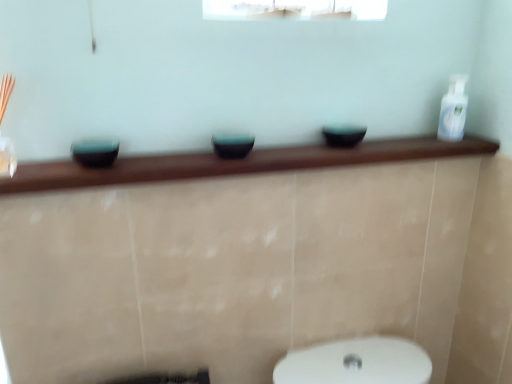
You are a GUI agent. You are given a task and a screenshot of the screen. Output one action in this format:
    pyautogui.click(x=<x>, y=<y>)
    Task: Click on the teal glossy bowl at left, which appears as the 1th basin when viewed from the left
    Image resolution: width=512 pixels, height=384 pixels.
    Given the screenshot: What is the action you would take?
    pyautogui.click(x=95, y=152)

This screenshot has width=512, height=384. What are the coordinates of `white glossy bottle at upper right` in the screenshot? It's located at (453, 109).

Measure the distance between matte black bowl at center, which is the 2th basin from left to right, and camera.

matte black bowl at center, which is the 2th basin from left to right, is 38.02 inches away from camera.

Where is `matte black bowl at center, the 2th basin when ordered from right to left`? The width and height of the screenshot is (512, 384). matte black bowl at center, the 2th basin when ordered from right to left is located at coordinates (232, 145).

Identify the location of matte black bowl at center, which ranks as the 1th basin in right-to-left order. (343, 135).

From the image's perspective, is matte black bowl at center, the 2th basin when ordered from right to left, on top of white glossy bottle at upper right?

No.

Is the depth of matte black bowl at center, the 2th basin when ordered from right to left, greater than that of white glossy bottle at upper right?

No.

Is matte black bowl at center, which is the 2th basin from left to right, in contact with white glossy bottle at upper right?

matte black bowl at center, which is the 2th basin from left to right, and white glossy bottle at upper right are not in contact.

Can you confirm if matte black bowl at center, which is the 2th basin from left to right, is taller than white glossy bottle at upper right?

No, matte black bowl at center, which is the 2th basin from left to right, is not taller than white glossy bottle at upper right.

From the picture: Considering the relative positions of white glossy bottle at upper right and teal glossy bowl at left, which appears as the 1th basin when viewed from the left, in the image provided, is white glossy bottle at upper right to the left or to the right of teal glossy bowl at left, which appears as the 1th basin when viewed from the left,?

Based on their positions, white glossy bottle at upper right is located to the right of teal glossy bowl at left, which appears as the 1th basin when viewed from the left.

From a real-world perspective, relative to teal glossy bowl at left, which appears as the 1th basin when viewed from the left, is white glossy bottle at upper right vertically above or below?

white glossy bottle at upper right is situated higher than teal glossy bowl at left, which appears as the 1th basin when viewed from the left, in the real world.

Can you confirm if white glossy bottle at upper right is wider than teal glossy bowl at left, which appears as the 1th basin when viewed from the left?

In fact, white glossy bottle at upper right might be narrower than teal glossy bowl at left, which appears as the 1th basin when viewed from the left.

From the image's perspective, which object appears higher, white glossy bottle at upper right or teal glossy bowl at left, which is the 3th basin from right to left?

white glossy bottle at upper right.

Is matte black bowl at center, which ranks as the 1th basin in right-to-left order, touching teal glossy bowl at left, which is the 3th basin from right to left?

They are not placed beside each other.

From the image's perspective, who appears lower, matte black bowl at center, which ranks as the 1th basin in right-to-left order, or teal glossy bowl at left, which appears as the 1th basin when viewed from the left?

teal glossy bowl at left, which appears as the 1th basin when viewed from the left, from the image's perspective.

Which of these two, matte black bowl at center, the 3th basin from the left, or teal glossy bowl at left, which appears as the 1th basin when viewed from the left, stands taller?

Standing taller between the two is teal glossy bowl at left, which appears as the 1th basin when viewed from the left.

Does point (345, 147) appear closer or farther from the camera than point (95, 162)?

Point (345, 147) is positioned farther from the camera compared to point (95, 162).

Identify the location of basin on the right side of matte black bowl at center, which is the 2th basin from left to right. (343, 135).

Which object is positioned more to the right, matte black bowl at center, which ranks as the 1th basin in right-to-left order, or matte black bowl at center, which is the 2th basin from left to right?

matte black bowl at center, which ranks as the 1th basin in right-to-left order.

Which object is further away from the camera, matte black bowl at center, which ranks as the 1th basin in right-to-left order, or matte black bowl at center, the 2th basin when ordered from right to left?

matte black bowl at center, which ranks as the 1th basin in right-to-left order, is behind.

Considering the sizes of matte black bowl at center, the 3th basin from the left, and matte black bowl at center, the 2th basin when ordered from right to left, in the image, is matte black bowl at center, the 3th basin from the left, wider or thinner than matte black bowl at center, the 2th basin when ordered from right to left,?

Clearly, matte black bowl at center, the 3th basin from the left, has more width compared to matte black bowl at center, the 2th basin when ordered from right to left.

Considering the sizes of objects matte black bowl at center, the 3th basin from the left, and white glossy bottle at upper right in the image provided, who is thinner, matte black bowl at center, the 3th basin from the left, or white glossy bottle at upper right?

Thinner between the two is white glossy bottle at upper right.

Is matte black bowl at center, which ranks as the 1th basin in right-to-left order, positioned in front of white glossy bottle at upper right?

Yes, matte black bowl at center, which ranks as the 1th basin in right-to-left order, is closer to the camera.

Is matte black bowl at center, which ranks as the 1th basin in right-to-left order, not near white glossy bottle at upper right?

No, matte black bowl at center, which ranks as the 1th basin in right-to-left order, is not far away from white glossy bottle at upper right.

Could you tell me if matte black bowl at center, the 3th basin from the left, is facing white glossy bottle at upper right?

No, matte black bowl at center, the 3th basin from the left, is not facing towards white glossy bottle at upper right.

How different are the orientations of white glossy bottle at upper right and matte black bowl at center, which ranks as the 1th basin in right-to-left order, in degrees?

0.00203 degrees.

Does point (462, 90) come in front of point (326, 131)?

No, (462, 90) is behind (326, 131).

From a real-world perspective, relative to matte black bowl at center, the 3th basin from the left, is white glossy bottle at upper right vertically above or below?

Clearly, from a real-world perspective, white glossy bottle at upper right is above matte black bowl at center, the 3th basin from the left.

Considering the sizes of white glossy bottle at upper right and matte black bowl at center, which ranks as the 1th basin in right-to-left order, in the image, is white glossy bottle at upper right wider or thinner than matte black bowl at center, which ranks as the 1th basin in right-to-left order,?

Clearly, white glossy bottle at upper right has less width compared to matte black bowl at center, which ranks as the 1th basin in right-to-left order.

Consider the image. Can teal glossy bowl at left, which appears as the 1th basin when viewed from the left, be found inside matte black bowl at center, which is the 2th basin from left to right?

No.

Is matte black bowl at center, the 2th basin when ordered from right to left, facing away from teal glossy bowl at left, which appears as the 1th basin when viewed from the left?

matte black bowl at center, the 2th basin when ordered from right to left, is not turned away from teal glossy bowl at left, which appears as the 1th basin when viewed from the left.

Considering the positions of objects matte black bowl at center, which is the 2th basin from left to right, and teal glossy bowl at left, which is the 3th basin from right to left, in the image provided, who is in front, matte black bowl at center, which is the 2th basin from left to right, or teal glossy bowl at left, which is the 3th basin from right to left,?

Positioned in front is teal glossy bowl at left, which is the 3th basin from right to left.

From the image's perspective, which object appears higher, matte black bowl at center, the 2th basin when ordered from right to left, or teal glossy bowl at left, which appears as the 1th basin when viewed from the left?

matte black bowl at center, the 2th basin when ordered from right to left, from the image's perspective.

Locate an element on the screen. The width and height of the screenshot is (512, 384). toiletry to the right of matte black bowl at center, which is the 2th basin from left to right is located at coordinates (453, 109).

There is a teal glossy bowl at left, which appears as the 1th basin when viewed from the left. Where is `toiletry above it (from a real-world perspective)`? The height and width of the screenshot is (384, 512). toiletry above it (from a real-world perspective) is located at coordinates (453, 109).

In the scene shown: Which object lies further to the anchor point matte black bowl at center, which ranks as the 1th basin in right-to-left order, teal glossy bowl at left, which appears as the 1th basin when viewed from the left, or white glossy bottle at upper right?

teal glossy bowl at left, which appears as the 1th basin when viewed from the left, is positioned further to the anchor matte black bowl at center, which ranks as the 1th basin in right-to-left order.

Considering their positions, is white glossy bottle at upper right positioned further to teal glossy bowl at left, which is the 3th basin from right to left, than matte black bowl at center, the 2th basin when ordered from right to left?

white glossy bottle at upper right is positioned further to the anchor teal glossy bowl at left, which is the 3th basin from right to left.

When comparing their distances from matte black bowl at center, which is the 2th basin from left to right, does matte black bowl at center, the 3th basin from the left, or teal glossy bowl at left, which appears as the 1th basin when viewed from the left, seem closer?

matte black bowl at center, the 3th basin from the left.

Based on their spatial positions, is teal glossy bowl at left, which is the 3th basin from right to left, or matte black bowl at center, which ranks as the 1th basin in right-to-left order, further from matte black bowl at center, which is the 2th basin from left to right?

The object further to matte black bowl at center, which is the 2th basin from left to right, is teal glossy bowl at left, which is the 3th basin from right to left.

When comparing their distances from matte black bowl at center, which ranks as the 1th basin in right-to-left order, does white glossy bottle at upper right or teal glossy bowl at left, which appears as the 1th basin when viewed from the left, seem closer?

white glossy bottle at upper right lies closer to matte black bowl at center, which ranks as the 1th basin in right-to-left order, than the other object.

Estimate the real-world distances between objects in this image. Which object is further from teal glossy bowl at left, which is the 3th basin from right to left, matte black bowl at center, the 2th basin when ordered from right to left, or matte black bowl at center, which ranks as the 1th basin in right-to-left order?

matte black bowl at center, which ranks as the 1th basin in right-to-left order.

Based on their spatial positions, is matte black bowl at center, which ranks as the 1th basin in right-to-left order, or white glossy bottle at upper right further from matte black bowl at center, which is the 2th basin from left to right?

Based on the image, white glossy bottle at upper right appears to be further to matte black bowl at center, which is the 2th basin from left to right.

From the image, which object appears to be nearer to matte black bowl at center, the 2th basin when ordered from right to left, white glossy bottle at upper right or matte black bowl at center, the 3th basin from the left?

Among the two, matte black bowl at center, the 3th basin from the left, is located nearer to matte black bowl at center, the 2th basin when ordered from right to left.

The width and height of the screenshot is (512, 384). Find the location of `basin between teal glossy bowl at left, which is the 3th basin from right to left, and matte black bowl at center, the 3th basin from the left`. basin between teal glossy bowl at left, which is the 3th basin from right to left, and matte black bowl at center, the 3th basin from the left is located at coordinates (232, 145).

The width and height of the screenshot is (512, 384). I want to click on basin between matte black bowl at center, the 2th basin when ordered from right to left, and white glossy bottle at upper right, in the horizontal direction, so click(x=343, y=135).